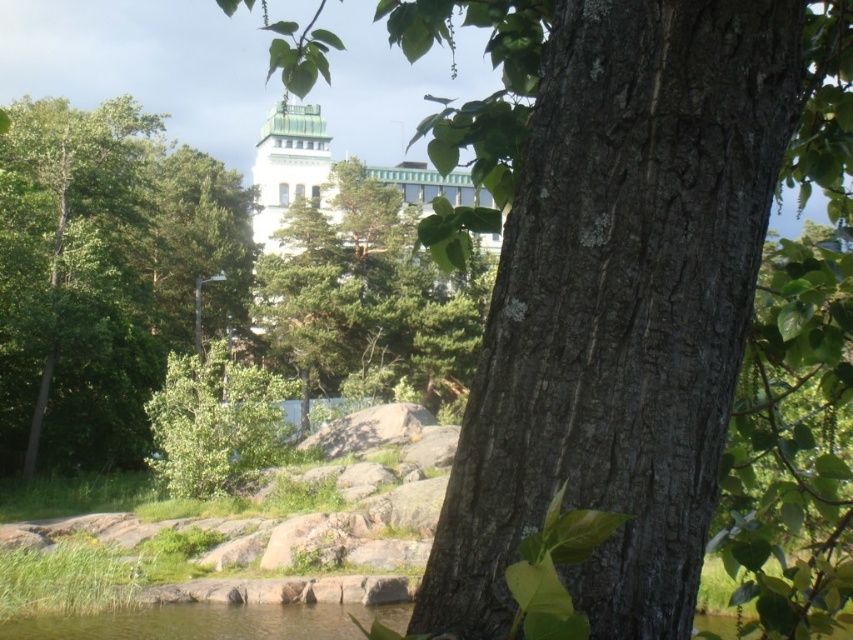
Can you confirm if smooth bark tree trunk at center is bigger than green leafy tree at lower left?

No.

Is smooth bark tree trunk at center further to the viewer compared to green leafy tree at lower left?

No, smooth bark tree trunk at center is closer to the viewer.

What do you see at coordinates (619, 307) in the screenshot? I see `smooth bark tree trunk at center` at bounding box center [619, 307].

Find the location of a particular element. This screenshot has height=640, width=853. smooth bark tree trunk at center is located at coordinates coord(619,307).